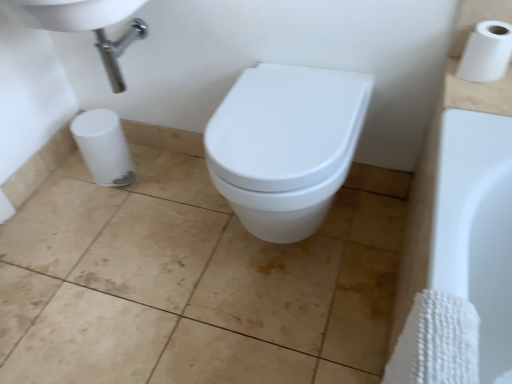
Question: Is beige ceramic tile at center not near white glossy toilet at center?

Choices:
 (A) yes
 (B) no

Answer: (B)

Question: Can you confirm if beige ceramic tile at center is positioned to the right of white glossy toilet at center?

Choices:
 (A) no
 (B) yes

Answer: (A)

Question: Is beige ceramic tile at center placed right next to white glossy toilet at center?

Choices:
 (A) yes
 (B) no

Answer: (B)

Question: Is beige ceramic tile at center taller than white glossy toilet at center?

Choices:
 (A) no
 (B) yes

Answer: (A)

Question: Is beige ceramic tile at center not inside white glossy toilet at center?

Choices:
 (A) yes
 (B) no

Answer: (A)

Question: From a real-world perspective, is beige ceramic tile at center over white glossy toilet at center?

Choices:
 (A) yes
 (B) no

Answer: (B)

Question: From the image's perspective, is white glossy toilet at center under white matte toilet paper at upper right?

Choices:
 (A) no
 (B) yes

Answer: (B)

Question: Considering the relative sizes of white glossy toilet at center and white matte toilet paper at upper right in the image provided, is white glossy toilet at center wider than white matte toilet paper at upper right?

Choices:
 (A) yes
 (B) no

Answer: (A)

Question: From the image's perspective, is white glossy toilet at center located above white matte toilet paper at upper right?

Choices:
 (A) yes
 (B) no

Answer: (B)

Question: Is white glossy toilet at center taller than white matte toilet paper at upper right?

Choices:
 (A) no
 (B) yes

Answer: (B)

Question: Is white glossy toilet at center further to the viewer compared to white matte toilet paper at upper right?

Choices:
 (A) yes
 (B) no

Answer: (B)

Question: Is white glossy toilet at center surrounding white matte toilet paper at upper right?

Choices:
 (A) yes
 (B) no

Answer: (B)

Question: From a real-world perspective, is white glossy toilet at center positioned under white glossy sink at upper left based on gravity?

Choices:
 (A) yes
 (B) no

Answer: (A)